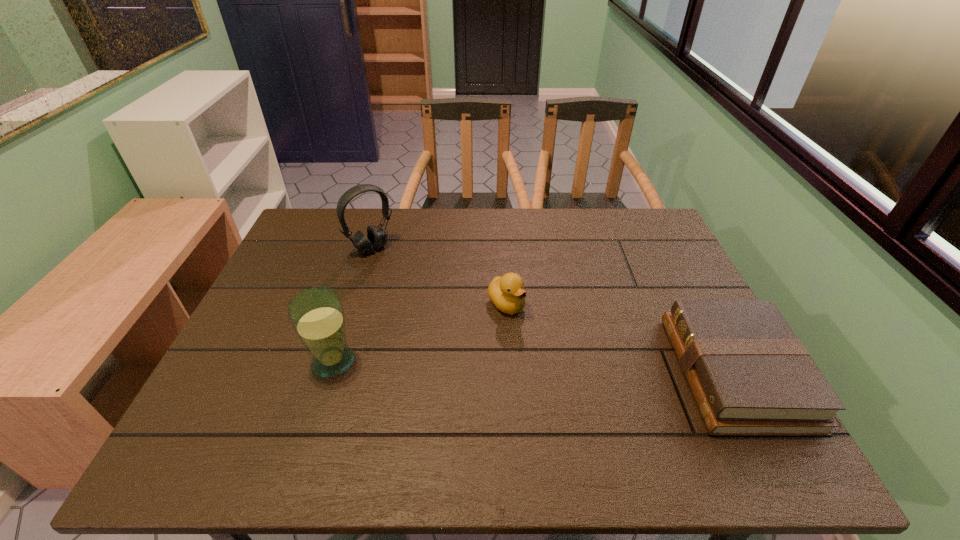
Where is `free space located 0.190m on the front-facing side of the farthest object`? free space located 0.190m on the front-facing side of the farthest object is located at coordinates click(417, 292).

Find the location of `vacant position located 0.230m on the front-facing side of the farthest object`. vacant position located 0.230m on the front-facing side of the farthest object is located at coordinates (425, 299).

Locate an element on the screen. vacant space located on the front-facing side of the farthest object is located at coordinates (448, 323).

Where is `vacant region located on the face of the duckling`? This screenshot has width=960, height=540. vacant region located on the face of the duckling is located at coordinates (540, 340).

Find the location of a particular element. free space located 0.270m on the face of the duckling is located at coordinates (592, 391).

At what (x,y) coordinates should I click in order to perform the action: click on vacant space situated 0.260m on the face of the duckling. Please return your answer as a coordinate pair (x, y). Image resolution: width=960 pixels, height=540 pixels. Looking at the image, I should click on (589, 388).

The image size is (960, 540). Identify the location of object that is positioned at the far edge. (376, 238).

At what (x,y) coordinates should I click in order to perform the action: click on object at the near edge. Please return your answer as a coordinate pair (x, y). This screenshot has height=540, width=960. Looking at the image, I should click on (750, 375).

You are a GUI agent. You are given a task and a screenshot of the screen. Output one action in this format:
    pyautogui.click(x=<x>, y=<y>)
    Task: Click on the object at the right edge
    The width and height of the screenshot is (960, 540).
    Given the screenshot: What is the action you would take?
    pyautogui.click(x=750, y=375)

At what (x,y) coordinates should I click in order to perform the action: click on object at the near right corner. Please return your answer as a coordinate pair (x, y). Looking at the image, I should click on (750, 375).